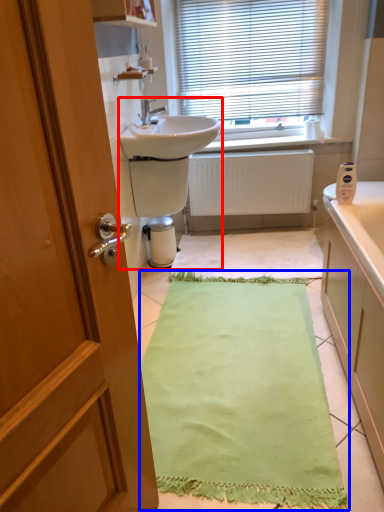
Question: Which of the following is the farthest to the observer, sink (highlighted by a red box) or bath mat (highlighted by a blue box)?

Choices:
 (A) sink
 (B) bath mat

Answer: (A)